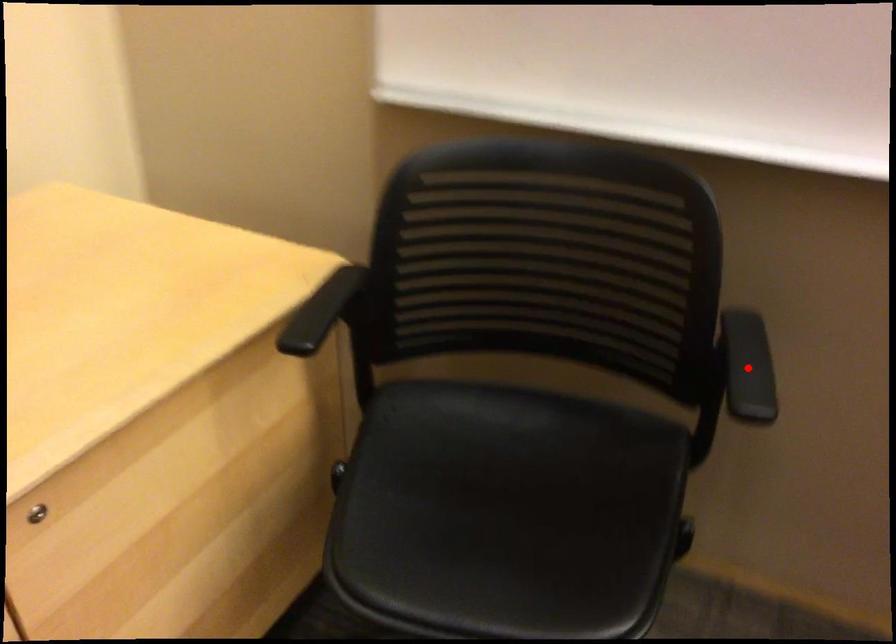
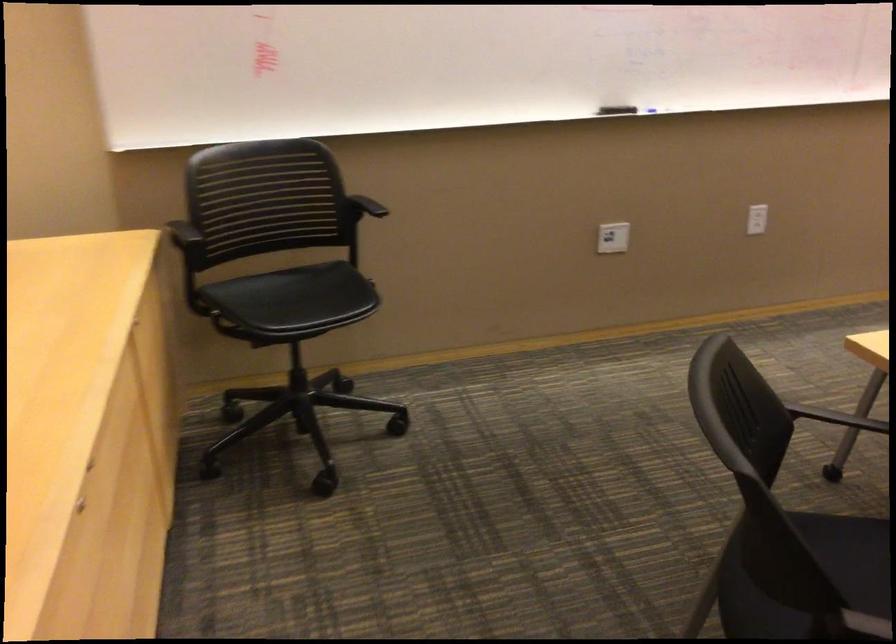
Question: A red point is marked in image1. In image2, is the corresponding 3D point closer to the camera or farther? Reply with the corresponding letter.

Choices:
 (A) The corresponding 3D point is closer.
 (B) The corresponding 3D point is farther.

Answer: (B)